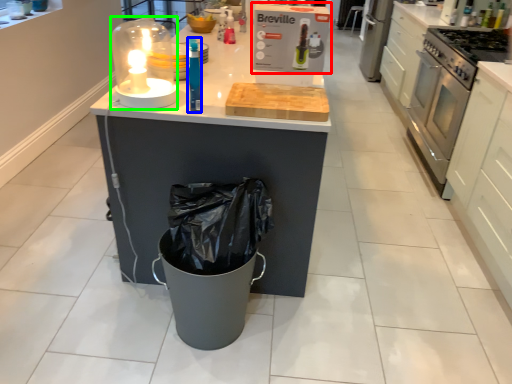
Question: Which object is the closest to the kitchen appliance (highlighted by a red box)? Choose among these: bottle (highlighted by a blue box) or candle holder (highlighted by a green box).

Choices:
 (A) bottle
 (B) candle holder

Answer: (A)